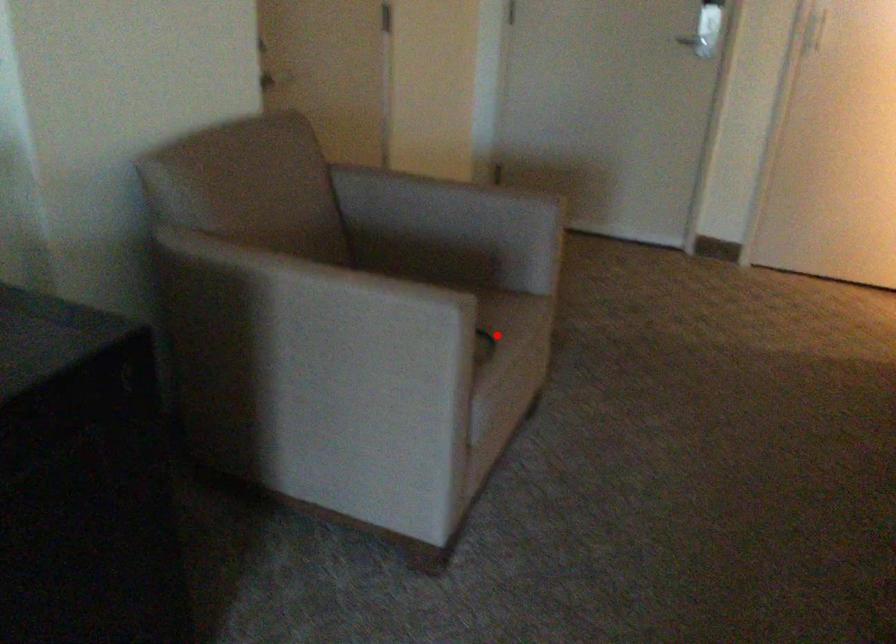
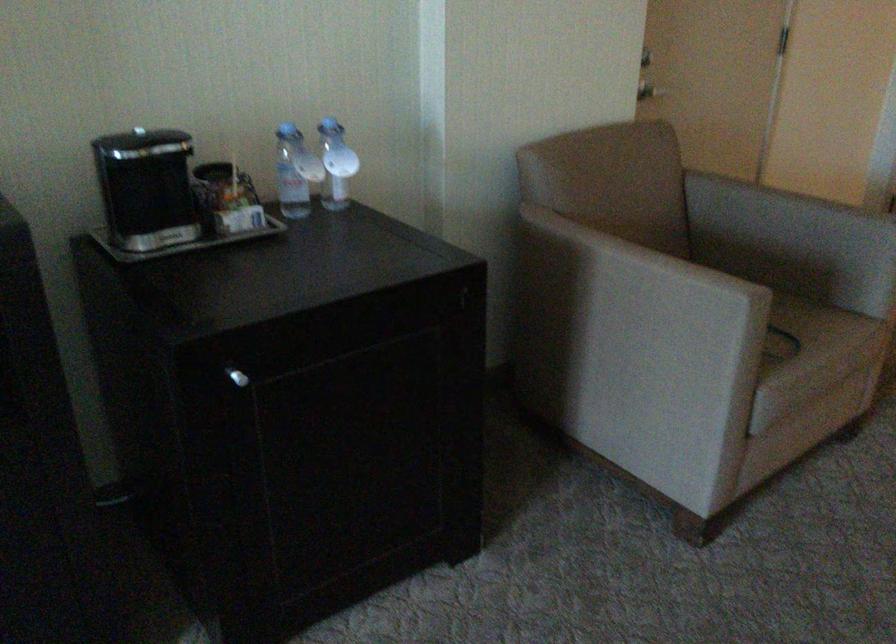
Where in the second image is the point corresponding to the highlighted location from the first image?

(811, 335)